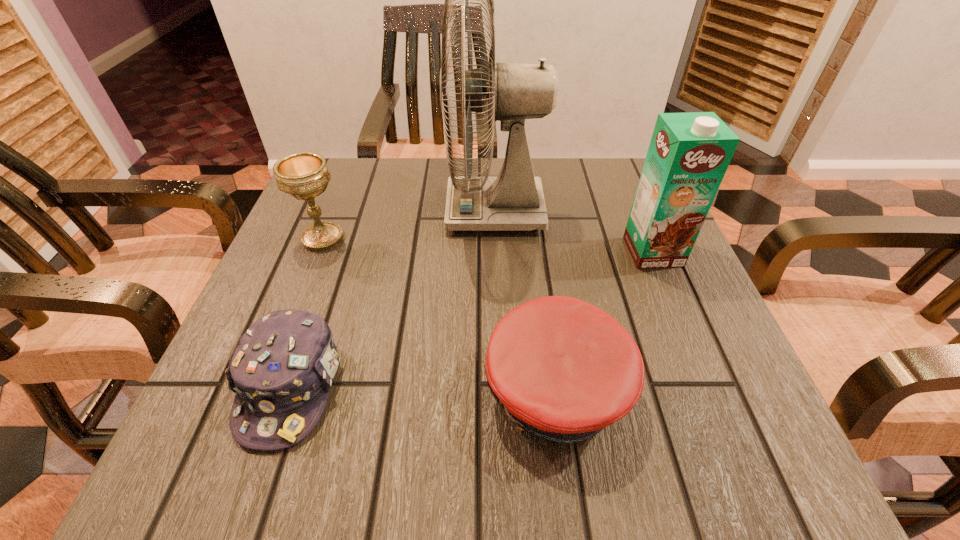
This screenshot has width=960, height=540. Find the location of `free space at the near edge`. free space at the near edge is located at coordinates (387, 421).

In the image, there is a desktop. Where is `blank space at the left edge`? This screenshot has height=540, width=960. blank space at the left edge is located at coordinates (295, 252).

In the image, there is a desktop. At what (x,y) coordinates should I click in order to perform the action: click on vacant space at the right edge. Please return your answer as a coordinate pair (x, y). The image size is (960, 540). Looking at the image, I should click on (684, 374).

The image size is (960, 540). I want to click on free space at the far left corner of the desktop, so click(x=364, y=172).

I want to click on vacant area at the far right corner of the desktop, so click(x=597, y=166).

The width and height of the screenshot is (960, 540). Identify the location of vacant region between the carton and the fan. [574, 232].

Locate an element on the screen. vacant area that lies between the tallest object and the left headwear is located at coordinates (393, 299).

What are the coordinates of `unoccupied area between the right headwear and the chalice` in the screenshot? It's located at (440, 314).

Where is `vacant area that lies between the right headwear and the chalice`? The height and width of the screenshot is (540, 960). vacant area that lies between the right headwear and the chalice is located at coordinates (440, 314).

The width and height of the screenshot is (960, 540). Identify the location of free area in between the left headwear and the right headwear. (423, 388).